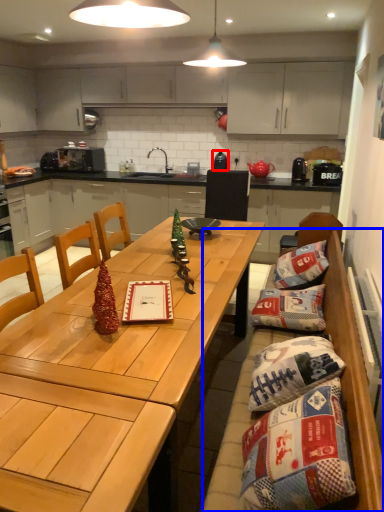
Question: Which object appears farthest to the camera in this image, appliance (highlighted by a red box) or bean bag chair (highlighted by a blue box)?

Choices:
 (A) appliance
 (B) bean bag chair

Answer: (A)